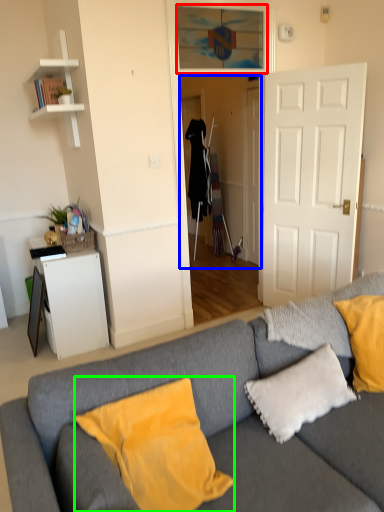
Question: Which object is the closest to the window (highlighted by a red box)? Choose among these: glass door (highlighted by a blue box) or pillow (highlighted by a green box).

Choices:
 (A) glass door
 (B) pillow

Answer: (A)